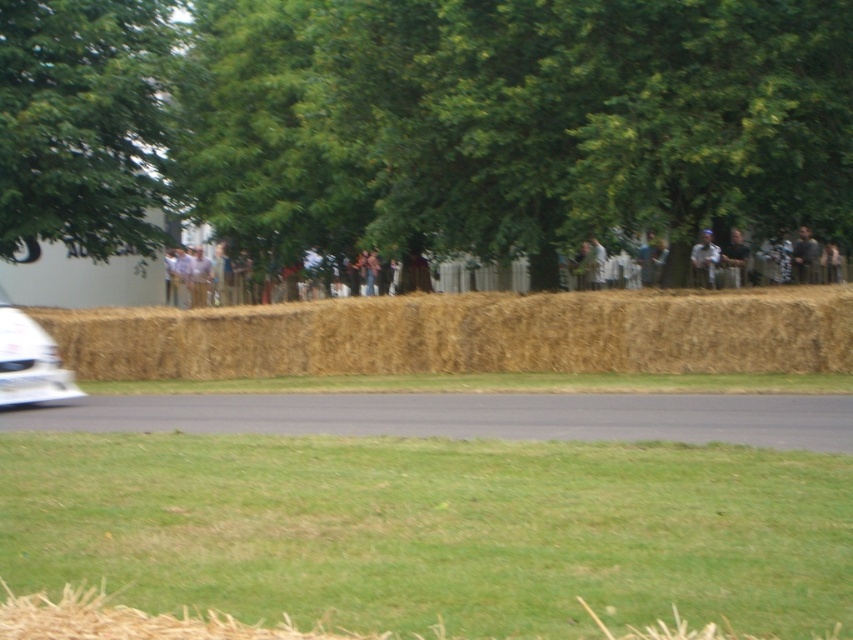
Is black asphalt road at center above white glossy car at left?

No, black asphalt road at center is not above white glossy car at left.

Where is `black asphalt road at center`? Image resolution: width=853 pixels, height=640 pixels. black asphalt road at center is located at coordinates (468, 417).

Where is `black asphalt road at center`? This screenshot has width=853, height=640. black asphalt road at center is located at coordinates (468, 417).

Can you confirm if brown straw bales at center is smaller than dark brown leather jacket at upper right?

No, brown straw bales at center is not smaller than dark brown leather jacket at upper right.

Can you confirm if brown straw bales at center is taller than dark brown leather jacket at upper right?

Indeed, brown straw bales at center has a greater height compared to dark brown leather jacket at upper right.

Who is more forward, (247, 333) or (733, 257)?

Point (247, 333)

The height and width of the screenshot is (640, 853). Identify the location of brown straw bales at center. (467, 333).

Is white glossy car at left wider than dark brown leather jacket at upper right?

No.

Is white glossy car at left smaller than dark brown leather jacket at upper right?

Correct, white glossy car at left occupies less space than dark brown leather jacket at upper right.

This screenshot has height=640, width=853. In order to click on white glossy car at left in this screenshot , I will do `click(30, 362)`.

Where is `white glossy car at left`? white glossy car at left is located at coordinates (30, 362).